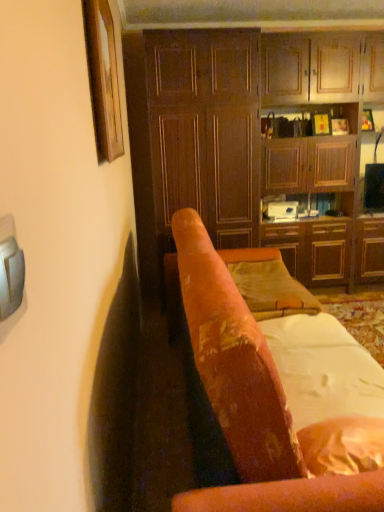
Question: Does white soft fabric at center have a smaller size compared to velvet-like orange chair at center?

Choices:
 (A) no
 (B) yes

Answer: (B)

Question: Would you say white soft fabric at center is outside velvet-like orange chair at center?

Choices:
 (A) no
 (B) yes

Answer: (A)

Question: From a real-world perspective, is white soft fabric at center physically below velvet-like orange chair at center?

Choices:
 (A) no
 (B) yes

Answer: (B)

Question: From the image's perspective, is white soft fabric at center under velvet-like orange chair at center?

Choices:
 (A) yes
 (B) no

Answer: (A)

Question: Does white soft fabric at center appear on the left side of velvet-like orange chair at center?

Choices:
 (A) no
 (B) yes

Answer: (A)

Question: Is wooden cabinet at center taller or shorter than wooden picture frame at upper left?

Choices:
 (A) tall
 (B) short

Answer: (A)

Question: Is wooden cabinet at center to the left or to the right of wooden picture frame at upper left in the image?

Choices:
 (A) right
 (B) left

Answer: (A)

Question: Considering their positions, is wooden cabinet at center located in front of or behind wooden picture frame at upper left?

Choices:
 (A) behind
 (B) front

Answer: (A)

Question: Considering the positions of wooden cabinet at center and wooden picture frame at upper left in the image, is wooden cabinet at center bigger or smaller than wooden picture frame at upper left?

Choices:
 (A) big
 (B) small

Answer: (A)

Question: From their relative heights in the image, would you say velvet-like orange chair at center is taller or shorter than wooden picture frame at upper left?

Choices:
 (A) short
 (B) tall

Answer: (B)

Question: Visually, is velvet-like orange chair at center positioned to the left or to the right of wooden picture frame at upper left?

Choices:
 (A) right
 (B) left

Answer: (A)

Question: Is velvet-like orange chair at center spatially inside wooden picture frame at upper left, or outside of it?

Choices:
 (A) inside
 (B) outside

Answer: (B)

Question: Is point (276, 393) closer or farther from the camera than point (110, 65)?

Choices:
 (A) closer
 (B) farther

Answer: (A)

Question: In terms of width, does wooden picture frame at upper left look wider or thinner when compared to wooden cabinet at right?

Choices:
 (A) thin
 (B) wide

Answer: (A)

Question: Is wooden picture frame at upper left situated inside wooden cabinet at right or outside?

Choices:
 (A) inside
 (B) outside

Answer: (B)